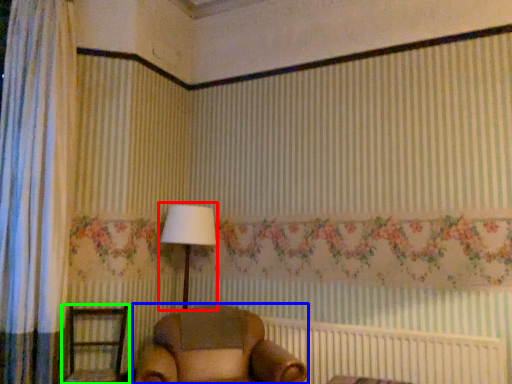
Question: Estimate the real-world distances between objects in this image. Which object is farther from table lamp (highlighted by a red box), furniture (highlighted by a blue box) or furniture (highlighted by a green box)?

Choices:
 (A) furniture
 (B) furniture

Answer: (B)